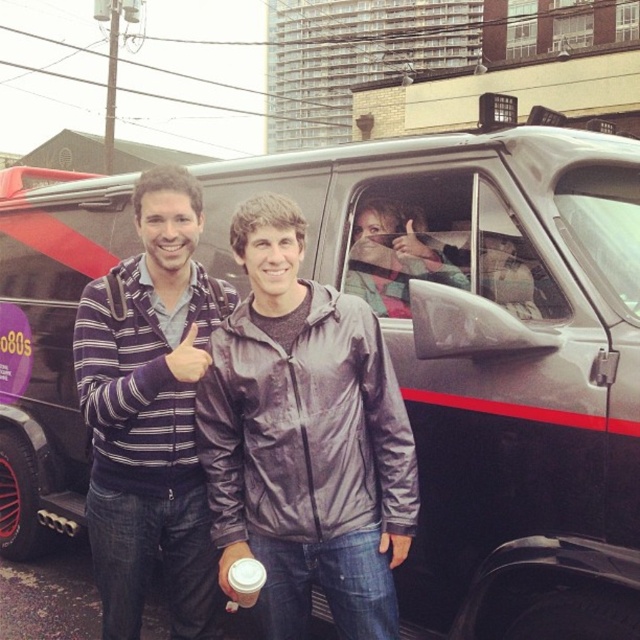
Question: Is striped sweater at center smaller than matte black hand at center?

Choices:
 (A) yes
 (B) no

Answer: (B)

Question: Can you confirm if plaid fabric shirt at center is thinner than matte plastic hand at upper center?

Choices:
 (A) no
 (B) yes

Answer: (A)

Question: Based on their relative distances, which object is farther from the matte black hand at center?

Choices:
 (A) plaid fabric shirt at center
 (B) matte plastic hand at upper center
 (C) striped sweater at center
 (D) shiny black jacket at center

Answer: (B)

Question: Which object is farther from the camera taking this photo?

Choices:
 (A) striped sweater at center
 (B) matte plastic hand at upper center

Answer: (B)

Question: Is shiny black jacket at center wider than striped sweater at center?

Choices:
 (A) yes
 (B) no

Answer: (A)

Question: Among these points, which one is farthest from the camera?

Choices:
 (A) (432, 243)
 (B) (392, 474)
 (C) (186, 620)
 (D) (412, 248)

Answer: (D)